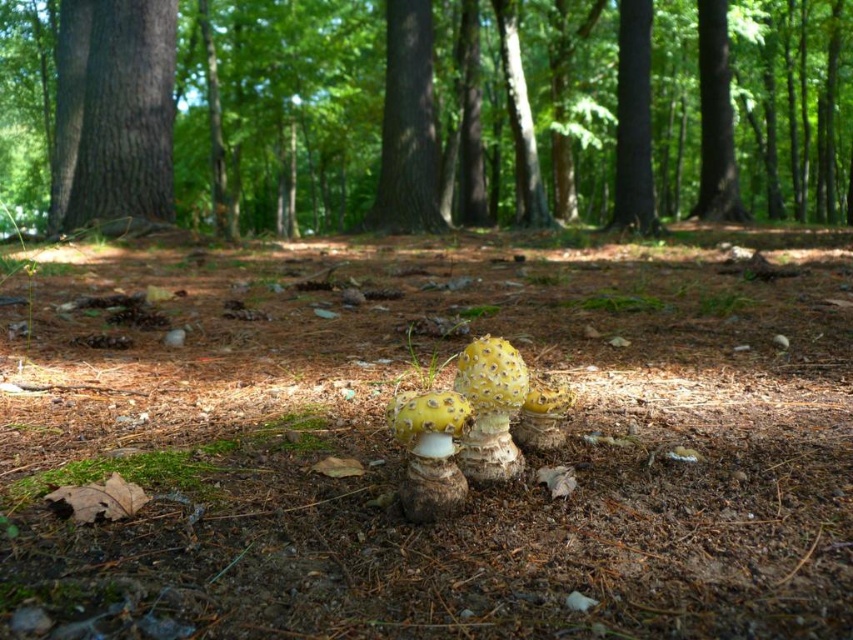
Is the position of smooth bark tree at center less distant than that of smooth dark brown tree trunk at upper center?

That is False.

Does point (407, 17) lie in front of point (653, 202)?

No, it is behind (653, 202).

Find the location of `smooth bark tree at center`. smooth bark tree at center is located at coordinates (407, 125).

This screenshot has height=640, width=853. Find the location of `smooth bark tree at center`. smooth bark tree at center is located at coordinates (407, 125).

What do you see at coordinates (426, 112) in the screenshot? This screenshot has width=853, height=640. I see `brown textured tree trunk at center` at bounding box center [426, 112].

Which is in front, point (605, 211) or point (654, 234)?

Point (654, 234)

This screenshot has height=640, width=853. I want to click on brown textured tree trunk at center, so click(426, 112).

Does point (155, 58) come in front of point (427, 106)?

Yes, point (155, 58) is in front of point (427, 106).

Between point (71, 198) and point (410, 102), which one is positioned behind?

The point (410, 102) is more distant.

Where is `brown textured tree trunk at center`? This screenshot has height=640, width=853. brown textured tree trunk at center is located at coordinates (426, 112).